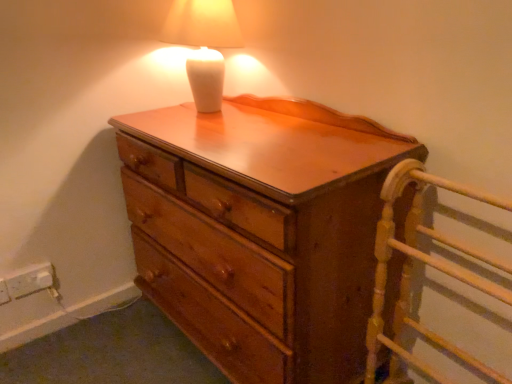
Question: Considering the relative positions of wooden bed frame at right and wooden chest of drawers at center in the image provided, is wooden bed frame at right to the left of wooden chest of drawers at center from the viewer's perspective?

Choices:
 (A) no
 (B) yes

Answer: (A)

Question: Would you say wooden chest of drawers at center is part of wooden bed frame at right's contents?

Choices:
 (A) yes
 (B) no

Answer: (B)

Question: Is wooden bed frame at right positioned far away from wooden chest of drawers at center?

Choices:
 (A) yes
 (B) no

Answer: (B)

Question: Is wooden bed frame at right looking in the opposite direction of wooden chest of drawers at center?

Choices:
 (A) no
 (B) yes

Answer: (A)

Question: Is wooden bed frame at right facing towards wooden chest of drawers at center?

Choices:
 (A) no
 (B) yes

Answer: (A)

Question: Considering the relative sizes of wooden bed frame at right and wooden chest of drawers at center in the image provided, is wooden bed frame at right smaller than wooden chest of drawers at center?

Choices:
 (A) yes
 (B) no

Answer: (A)

Question: From the image's perspective, is white plastic electric outlet at lower left beneath wooden bed frame at right?

Choices:
 (A) no
 (B) yes

Answer: (A)

Question: From a real-world perspective, is white plastic electric outlet at lower left beneath wooden bed frame at right?

Choices:
 (A) no
 (B) yes

Answer: (B)

Question: Considering the relative sizes of white plastic electric outlet at lower left and wooden bed frame at right in the image provided, is white plastic electric outlet at lower left bigger than wooden bed frame at right?

Choices:
 (A) no
 (B) yes

Answer: (A)

Question: Would you say white plastic electric outlet at lower left contains wooden bed frame at right?

Choices:
 (A) no
 (B) yes

Answer: (A)

Question: Considering the relative sizes of white plastic electric outlet at lower left and wooden bed frame at right in the image provided, is white plastic electric outlet at lower left taller than wooden bed frame at right?

Choices:
 (A) yes
 (B) no

Answer: (B)

Question: Is white plastic electric outlet at lower left positioned in front of wooden bed frame at right?

Choices:
 (A) no
 (B) yes

Answer: (A)

Question: Is wooden chest of drawers at center surrounding wooden bed frame at right?

Choices:
 (A) no
 (B) yes

Answer: (A)